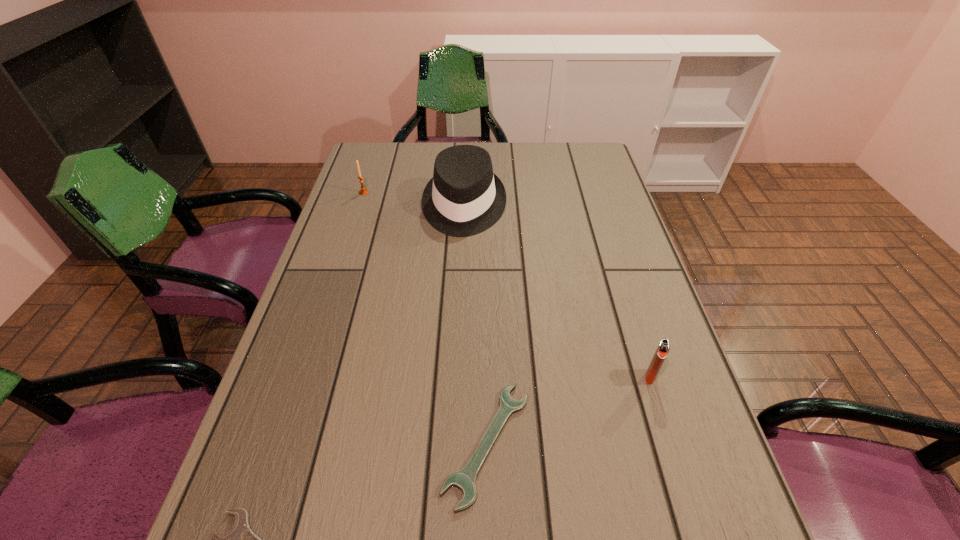
Where is `object situated at the left edge`? The height and width of the screenshot is (540, 960). object situated at the left edge is located at coordinates (363, 191).

Where is `object at the right edge`? Image resolution: width=960 pixels, height=540 pixels. object at the right edge is located at coordinates (663, 348).

The width and height of the screenshot is (960, 540). Identify the location of vacant area at the far edge. (492, 158).

Find the location of a particular element. The image size is (960, 540). vacant space at the left edge is located at coordinates (329, 310).

Locate an element on the screen. The height and width of the screenshot is (540, 960). free region at the right edge is located at coordinates (711, 443).

Image resolution: width=960 pixels, height=540 pixels. In the image, there is a desktop. In order to click on vacant space at the far left corner in this screenshot , I will do `click(382, 148)`.

Where is `free space at the far right corner of the desktop`? The height and width of the screenshot is (540, 960). free space at the far right corner of the desktop is located at coordinates (584, 172).

Image resolution: width=960 pixels, height=540 pixels. I want to click on free spot between the igniter and the fedora, so click(557, 292).

The height and width of the screenshot is (540, 960). I want to click on empty location between the igniter and the tallest object, so click(557, 292).

Image resolution: width=960 pixels, height=540 pixels. What are the coordinates of `free space between the candle_holder and the right wrench` in the screenshot? It's located at click(x=425, y=318).